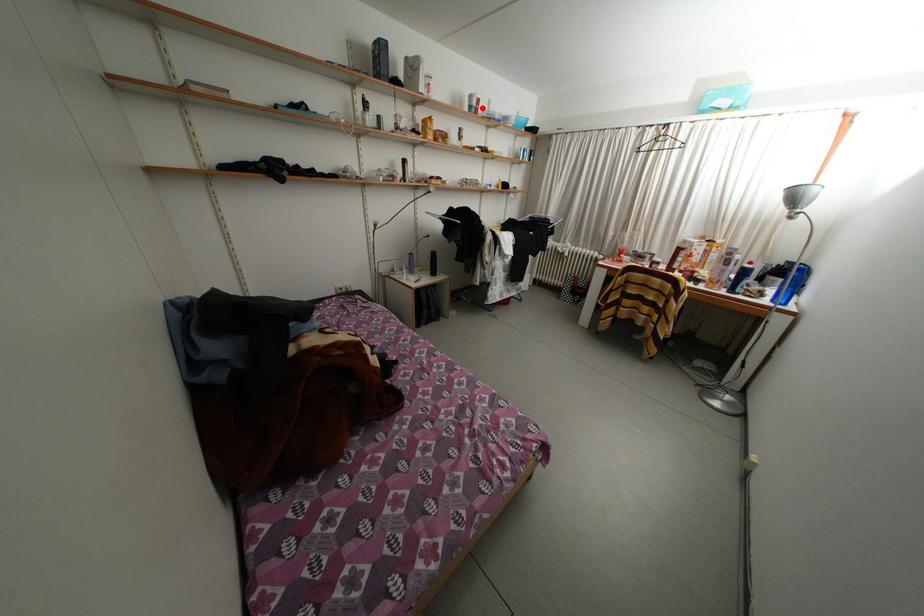
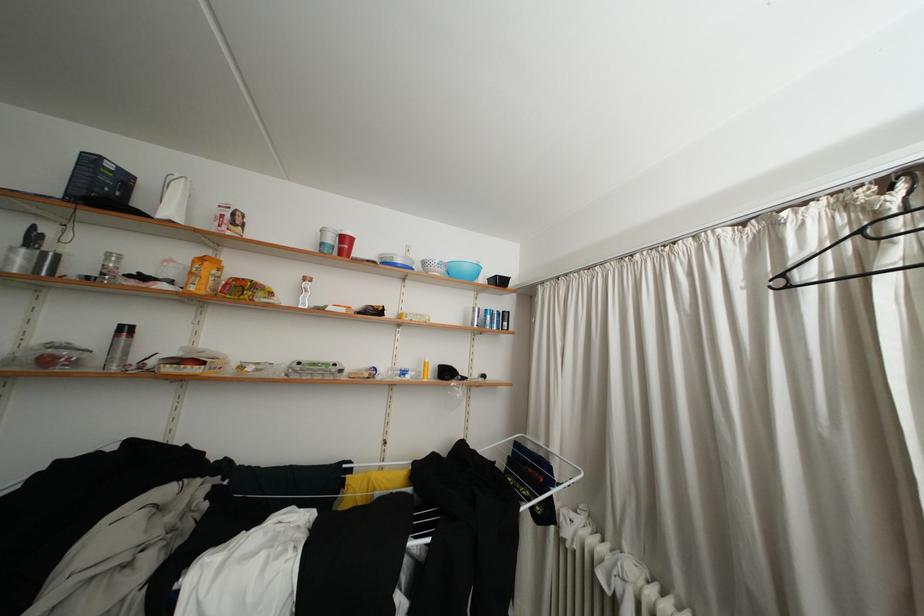
Where in the second image is the point corresponding to the highlighted location from the first image?

(338, 245)